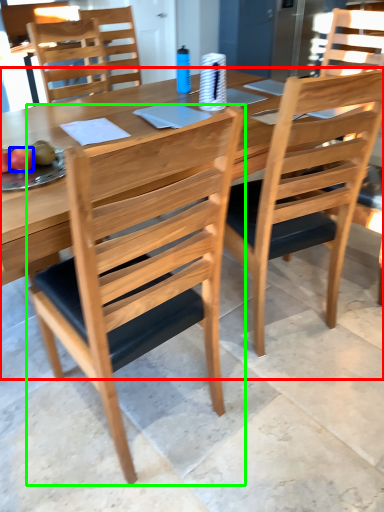
Question: Based on their relative distances, which object is nearer to table (highlighted by a red box)? Choose from fruit (highlighted by a blue box) and chair (highlighted by a green box).

Choices:
 (A) fruit
 (B) chair

Answer: (A)